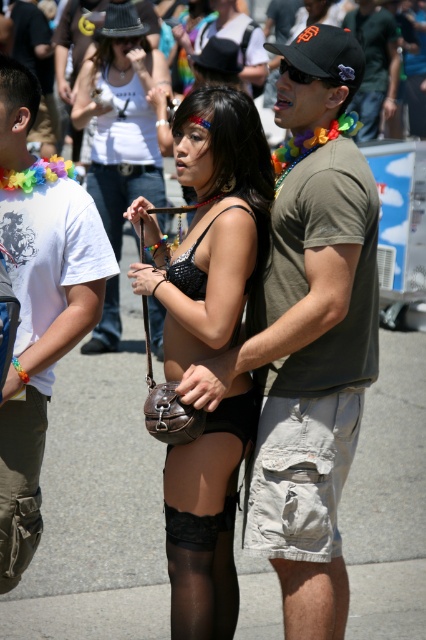
Can you confirm if leather bra at center is positioned above leather purse at center?

No.

Who is shorter, leather bra at center or leather purse at center?

leather purse at center is shorter.

Identify the location of leather bra at center. The height and width of the screenshot is (640, 426). (210, 227).

Is matte olive green t-shirt at center taller than white cotton t-shirt at left?

Yes.

Between point (236, 360) and point (71, 280), which one is positioned behind?

The point (71, 280) is more distant.

Image resolution: width=426 pixels, height=640 pixels. In order to click on matte olive green t-shirt at center in this screenshot , I will do `click(308, 336)`.

You are a GUI agent. You are given a task and a screenshot of the screen. Output one action in this format:
    pyautogui.click(x=<x>, y=<y>)
    Task: Click on the matte olive green t-shirt at center
    
    Given the screenshot: What is the action you would take?
    pyautogui.click(x=308, y=336)

Who is positioned more to the right, leather bra at center or matte black cap at upper center?

matte black cap at upper center

Is point (172, 282) positioned before point (391, 113)?

Yes, it is in front of point (391, 113).

Locate an element on the screen. This screenshot has width=426, height=640. leather bra at center is located at coordinates (210, 227).